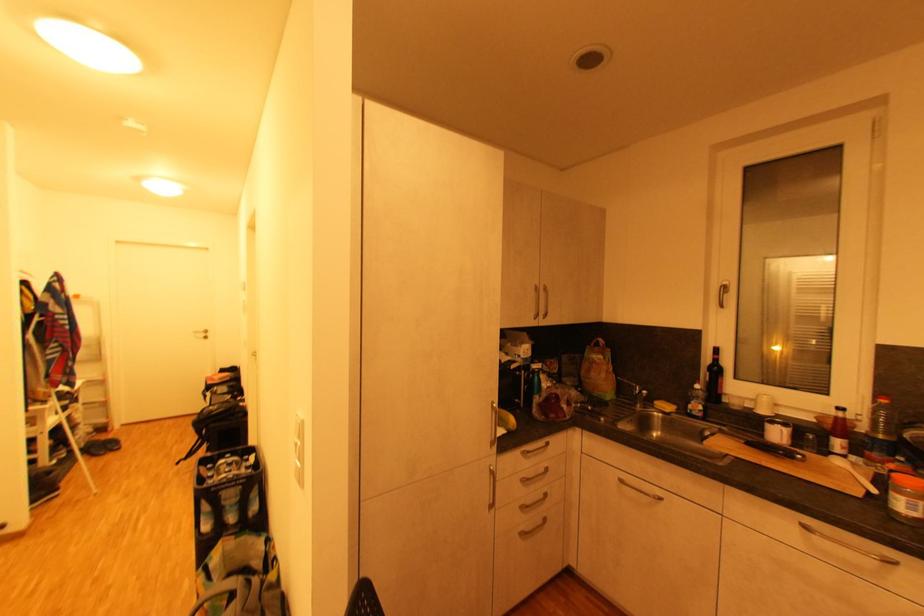
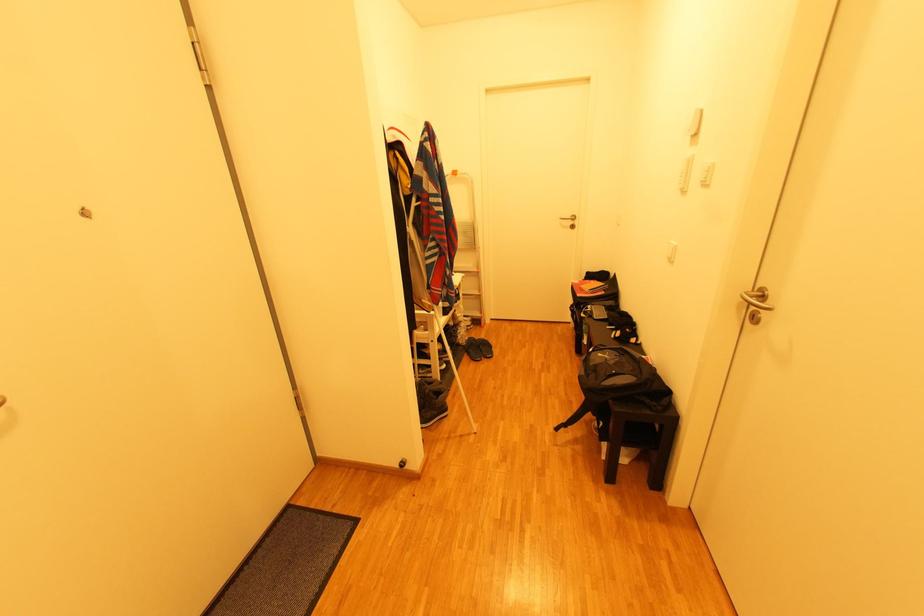
Question: I am providing you with two images of the same scene from different viewpoints. After the viewpoint changes to image2, which objects are now occluded?

Choices:
 (A) black backpack
 (B) black slide sandal
 (C) white step ladder
 (D) none of these

Answer: (D)